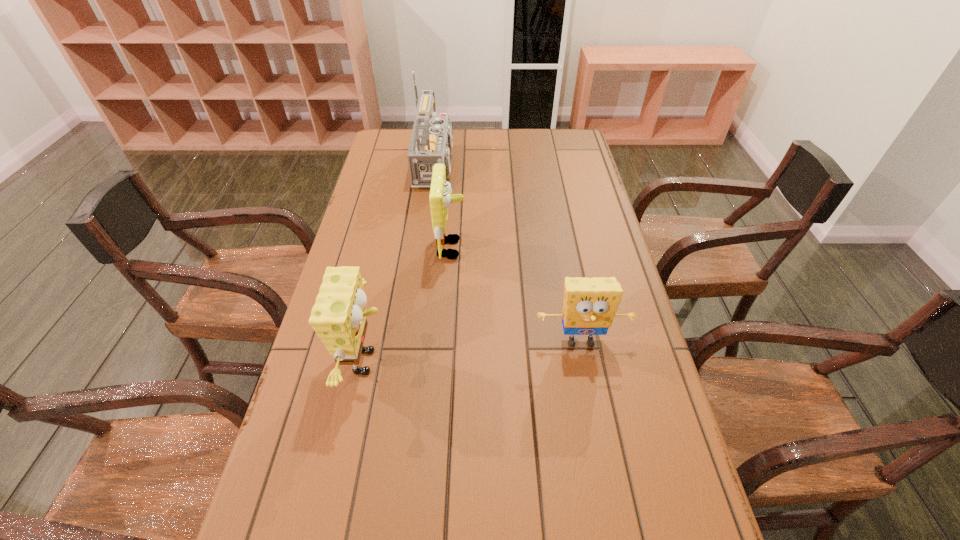
Image resolution: width=960 pixels, height=540 pixels. Identify the location of free space located 0.380m on the face of the shortest sponge. tap(619, 538).

At what (x,y) coordinates should I click in order to perform the action: click on object located at the far edge. Please return your answer as a coordinate pair (x, y). This screenshot has width=960, height=540. Looking at the image, I should click on (431, 142).

The image size is (960, 540). What are the coordinates of `radio receiver that is at the left edge` in the screenshot? It's located at (431, 142).

Identify the location of sponge located at the left edge. This screenshot has width=960, height=540. (338, 317).

Where is `object that is at the right edge`? The image size is (960, 540). object that is at the right edge is located at coordinates (589, 306).

Where is `object that is at the far left corner`? Image resolution: width=960 pixels, height=540 pixels. object that is at the far left corner is located at coordinates (431, 142).

The width and height of the screenshot is (960, 540). I want to click on free location at the far edge, so (520, 134).

You are a GUI agent. You are given a task and a screenshot of the screen. Output one action in this format:
    pyautogui.click(x=<x>, y=<y>)
    Task: Click on the vacant space at the left edge
    This screenshot has height=540, width=960.
    Given the screenshot: What is the action you would take?
    pyautogui.click(x=396, y=252)

Find the location of a particular element. This screenshot has width=960, height=540. free space at the right edge of the desktop is located at coordinates (608, 235).

Identify the location of free space at the far left corner of the desktop. (407, 148).